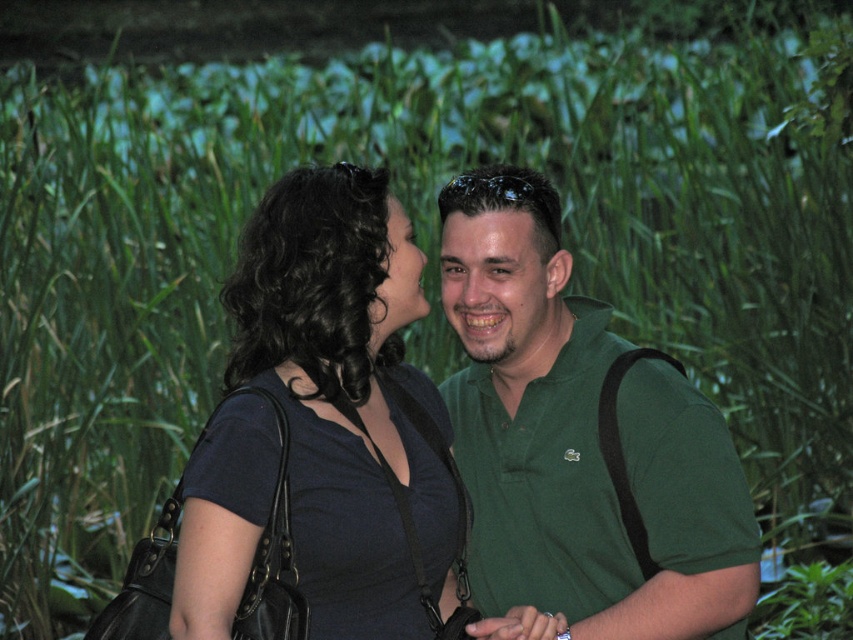
Image resolution: width=853 pixels, height=640 pixels. Describe the element at coordinates (581, 440) in the screenshot. I see `green matte shirt at center` at that location.

Can you confirm if green matte shirt at center is wider than matte black dress at center?

Correct, the width of green matte shirt at center exceeds that of matte black dress at center.

Is point (531, 298) closer to camera compared to point (453, 493)?

No, (531, 298) is further to viewer.

This screenshot has height=640, width=853. I want to click on green matte shirt at center, so click(581, 440).